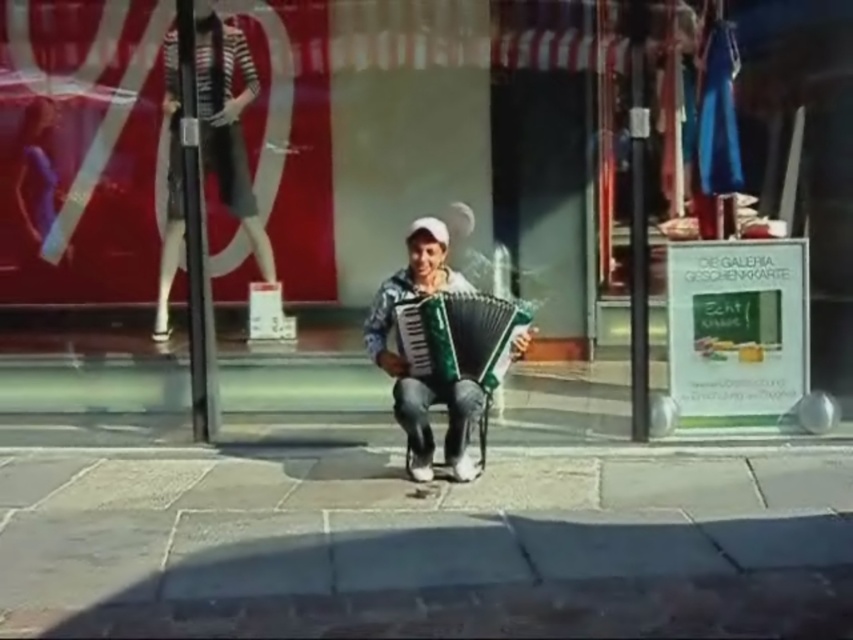
Question: Can you confirm if green plastic sign at center is bigger than green plastic accordion at center?

Choices:
 (A) no
 (B) yes

Answer: (B)

Question: Among these objects, which one is farthest from the camera?

Choices:
 (A) green plastic sign at center
 (B) gray stone pavement at center

Answer: (A)

Question: Which point appears closest to the camera in this image?

Choices:
 (A) (735, 576)
 (B) (421, 314)

Answer: (A)

Question: Which point is closer to the camera taking this photo?

Choices:
 (A) (113, 212)
 (B) (521, 346)

Answer: (B)

Question: Considering the relative positions of gray stone pavement at center and green fabric accordion at center in the image provided, where is gray stone pavement at center located with respect to green fabric accordion at center?

Choices:
 (A) right
 (B) left

Answer: (B)

Question: Where is green plastic sign at center located in relation to gray stone pavement at center in the image?

Choices:
 (A) left
 (B) right

Answer: (B)